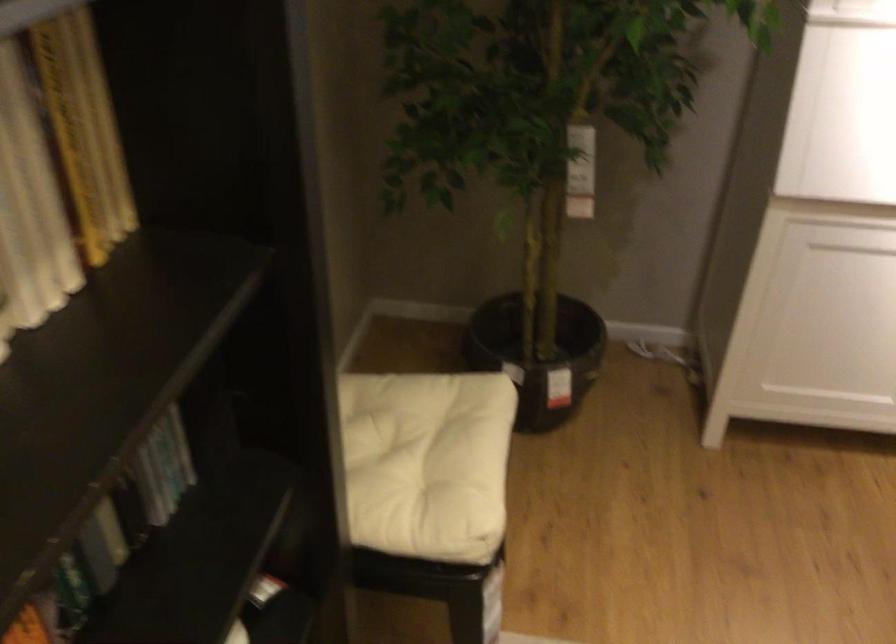
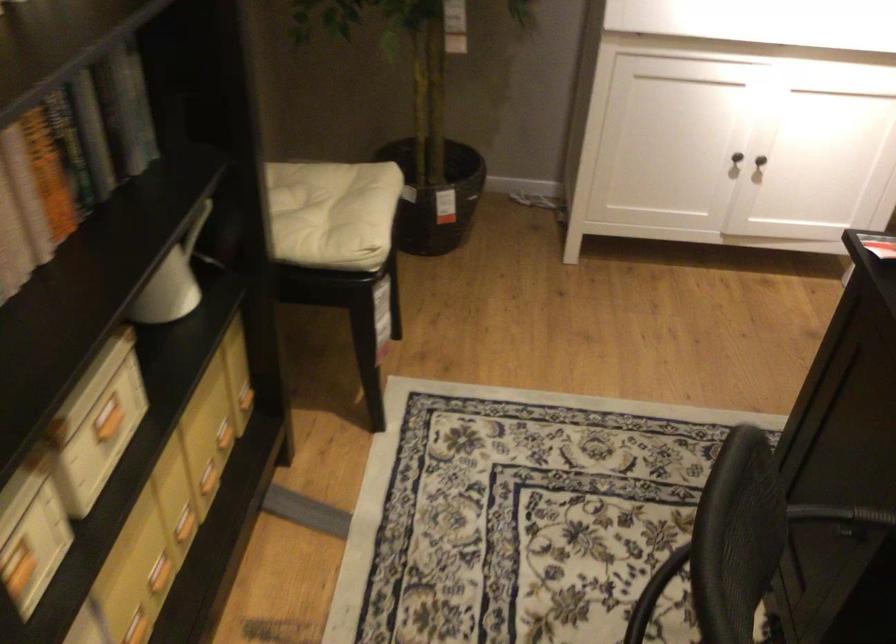
Question: The first image is from the beginning of the video and the second image is from the end. How did the camera likely rotate when shooting the video?

Choices:
 (A) Left
 (B) Right
 (C) Up
 (D) Down

Answer: (B)